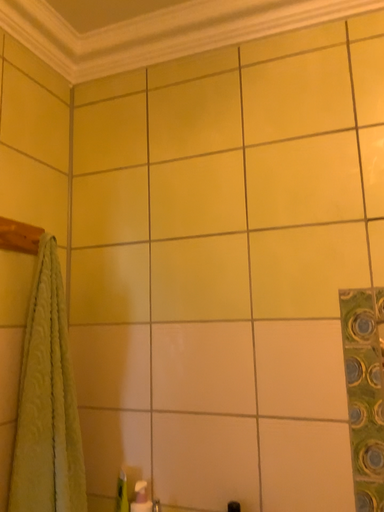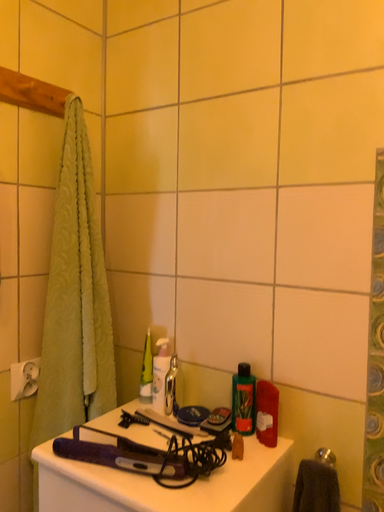
Question: Which way did the camera rotate in the video?

Choices:
 (A) rotated right
 (B) rotated left

Answer: (B)